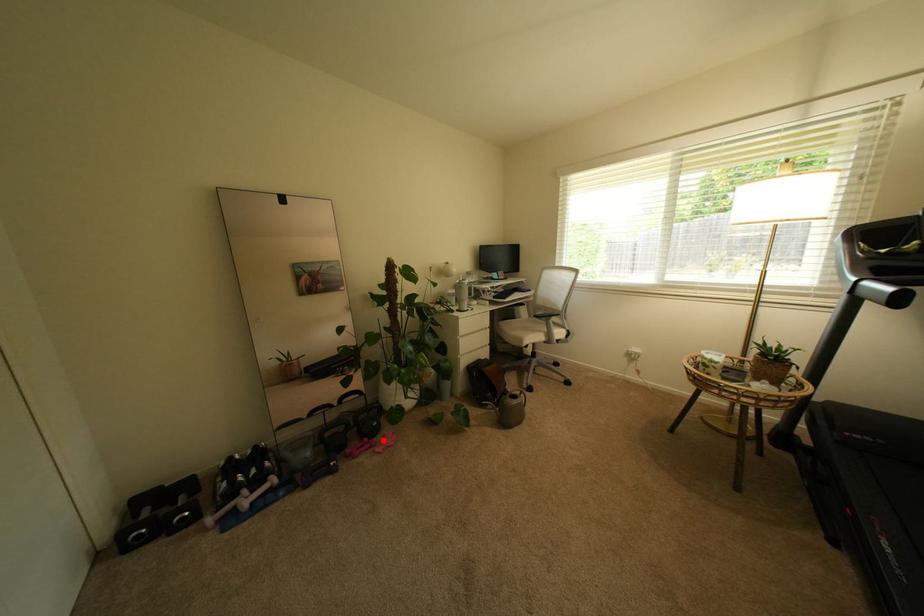
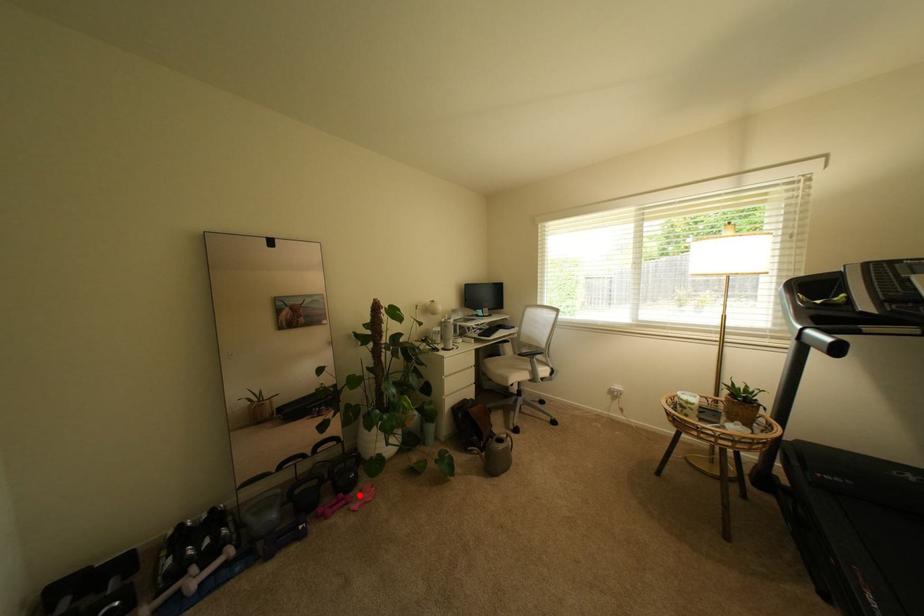
I am providing you with two images of the same scene from different viewpoints. A red point is marked on the first image and another point is marked on the second image. Is the red point in image1 aligned with the point shown in image2?

Yes